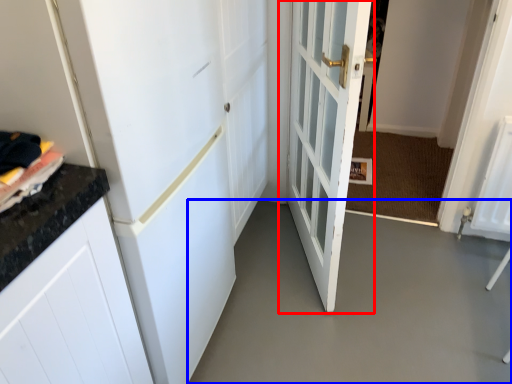
Question: Which of the following is the closest to the observer, door (highlighted by a red box) or concrete (highlighted by a blue box)?

Choices:
 (A) door
 (B) concrete

Answer: (A)